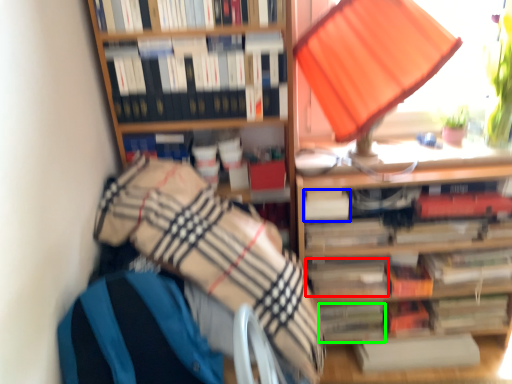
Question: Considering the real-world distances, which object is closest to paperback book (highlighted by a red box)? paperback book (highlighted by a blue box) or paperback book (highlighted by a green box).

Choices:
 (A) paperback book
 (B) paperback book

Answer: (B)